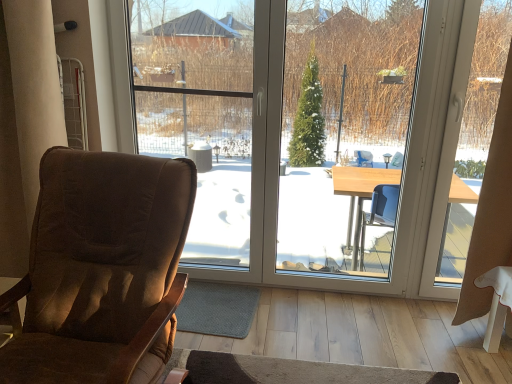
Question: Is beige fabric curtain at right shorter than transparent glass window screen at center?

Choices:
 (A) yes
 (B) no

Answer: (A)

Question: Can you confirm if beige fabric curtain at right is wider than transparent glass window screen at center?

Choices:
 (A) no
 (B) yes

Answer: (B)

Question: From the image's perspective, would you say beige fabric curtain at right is positioned over transparent glass window screen at center?

Choices:
 (A) yes
 (B) no

Answer: (B)

Question: From a real-world perspective, does beige fabric curtain at right sit lower than transparent glass window screen at center?

Choices:
 (A) yes
 (B) no

Answer: (A)

Question: Can you confirm if beige fabric curtain at right is taller than transparent glass window screen at center?

Choices:
 (A) yes
 (B) no

Answer: (B)

Question: Considering the positions of brown fabric chair at left and transparent glass window screen at center in the image, is brown fabric chair at left wider or thinner than transparent glass window screen at center?

Choices:
 (A) thin
 (B) wide

Answer: (B)

Question: Considering the relative positions of brown fabric chair at left and transparent glass window screen at center in the image provided, is brown fabric chair at left to the left or to the right of transparent glass window screen at center?

Choices:
 (A) left
 (B) right

Answer: (A)

Question: Is brown fabric chair at left in front of or behind transparent glass window screen at center in the image?

Choices:
 (A) front
 (B) behind

Answer: (A)

Question: From their relative heights in the image, would you say brown fabric chair at left is taller or shorter than transparent glass window screen at center?

Choices:
 (A) short
 (B) tall

Answer: (A)

Question: Considering the positions of beige fabric curtain at right and brown fabric chair at left in the image, is beige fabric curtain at right wider or thinner than brown fabric chair at left?

Choices:
 (A) wide
 (B) thin

Answer: (B)

Question: From the image's perspective, is beige fabric curtain at right located above or below brown fabric chair at left?

Choices:
 (A) above
 (B) below

Answer: (A)

Question: In the image, is beige fabric curtain at right on the left side or the right side of brown fabric chair at left?

Choices:
 (A) left
 (B) right

Answer: (B)

Question: Would you say beige fabric curtain at right is inside or outside brown fabric chair at left?

Choices:
 (A) outside
 (B) inside

Answer: (A)

Question: From a real-world perspective, relative to beige fabric curtain at right, is transparent glass window screen at center vertically above or below?

Choices:
 (A) below
 (B) above

Answer: (B)

Question: Based on their positions, is transparent glass window screen at center located to the left or right of beige fabric curtain at right?

Choices:
 (A) left
 (B) right

Answer: (A)